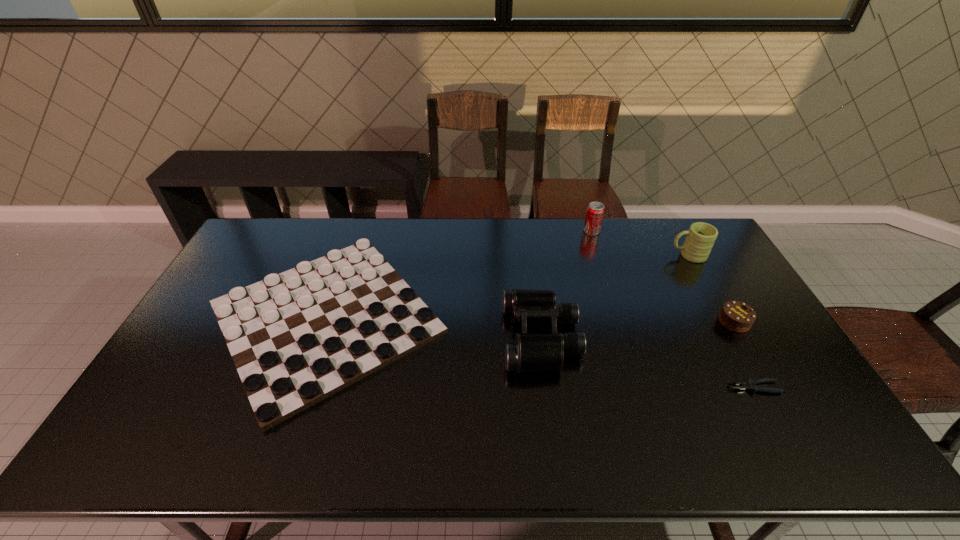
At what (x,y) coordinates should I click in order to perform the action: click on the farthest object. Please return your answer as a coordinate pair (x, y). Looking at the image, I should click on (595, 211).

The width and height of the screenshot is (960, 540). What are the coordinates of `soda can` in the screenshot? It's located at (595, 211).

Where is `mug`? Image resolution: width=960 pixels, height=540 pixels. mug is located at coordinates (701, 236).

Identify the location of the second object from left to right. (531, 352).

Identify the location of chocolate cake. This screenshot has height=540, width=960. (736, 316).

This screenshot has height=540, width=960. Find the location of `the second shortest object`. the second shortest object is located at coordinates (296, 338).

Find the location of `the leftmost object`. the leftmost object is located at coordinates (296, 338).

Find the location of a particular element. This screenshot has height=540, width=960. the shortest object is located at coordinates (749, 383).

Find the location of a particular element. The image size is (960, 540). free region located 0.050m on the back of the fourth object from right to left is located at coordinates (588, 219).

Locate an element on the screen. The width and height of the screenshot is (960, 540). vacant space positioned 0.170m on the side of the mug with the handle is located at coordinates 621,255.